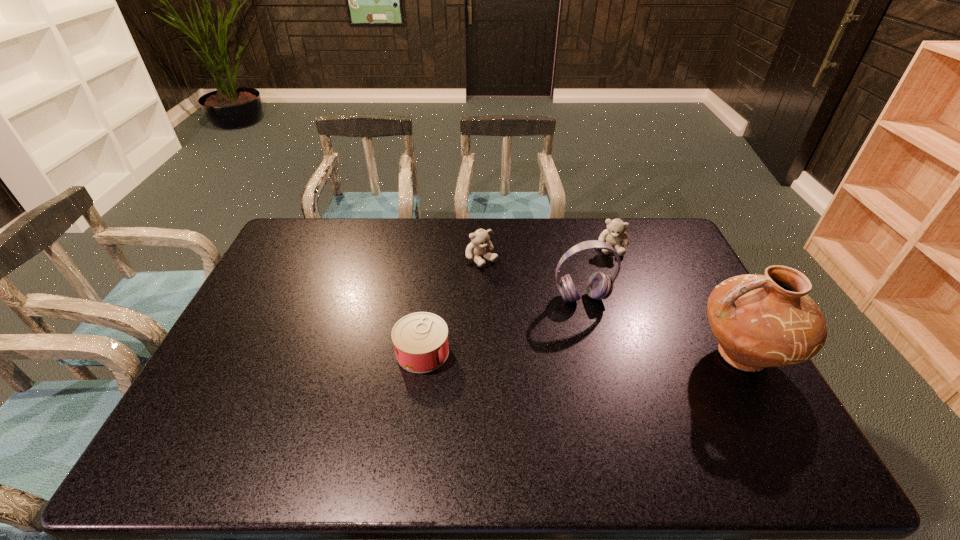
Find the location of a particular element. Image resolution: width=960 pixels, height=540 pixels. vacant space located 0.190m on the side of the rightmost object with the handle is located at coordinates (625, 355).

This screenshot has width=960, height=540. I want to click on vacant space located 0.320m on the side of the rightmost object with the handle, so click(x=579, y=355).

Where is `vacant space located 0.260m on the face of the fourth object from right to left`? vacant space located 0.260m on the face of the fourth object from right to left is located at coordinates (534, 315).

I want to click on free location located 0.160m on the face of the fourth object from right to left, so click(516, 296).

Locate an element on the screen. free space located 0.260m on the face of the fourth object from right to left is located at coordinates (534, 315).

Identify the location of vacant space situated 0.290m on the face of the second object from right to left. (612, 315).

You are a GUI agent. You are given a task and a screenshot of the screen. Output one action in this format:
    pyautogui.click(x=<x>, y=<y>)
    Task: Click on the free region located on the face of the second object from right to left
    
    Given the screenshot: What is the action you would take?
    pyautogui.click(x=612, y=280)

This screenshot has width=960, height=540. Identify the location of free spot located on the face of the second object from right to left. (612, 322).

Where is `vacant space located on the headband and ear cups of the third object from right to left`? vacant space located on the headband and ear cups of the third object from right to left is located at coordinates (615, 368).

Where is `vacant space located 0.120m on the headband and ear cups of the third object from right to left`? vacant space located 0.120m on the headband and ear cups of the third object from right to left is located at coordinates (602, 338).